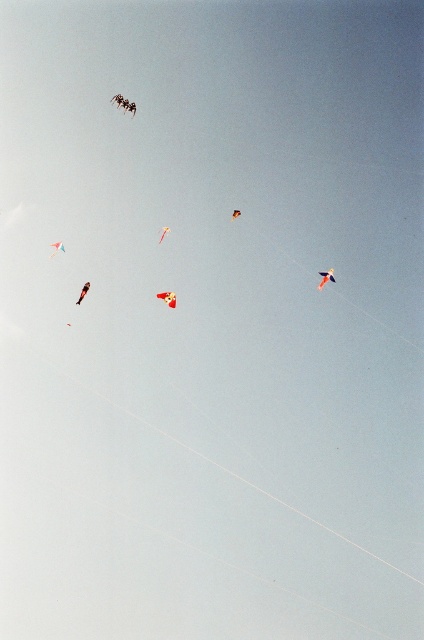
Question: Does shiny metallic kite at upper left lie in front of orange matte kite at upper center?

Choices:
 (A) no
 (B) yes

Answer: (B)

Question: Can you confirm if shiny metallic kite at upper left is thinner than translucent red kite at center?

Choices:
 (A) yes
 (B) no

Answer: (B)

Question: Among these objects, which one is farthest from the camera?

Choices:
 (A) translucent red kite at center
 (B) shiny metallic kite at center
 (C) orange matte kite at upper center
 (D) matte red kite at upper left

Answer: (B)

Question: Which point appears closest to the camera in this image?

Choices:
 (A) (169, 291)
 (B) (88, 289)
 (C) (60, 243)
 (D) (234, 211)

Answer: (A)

Question: Can you confirm if translucent red kite at center is smaller than orange matte kite at upper center?

Choices:
 (A) no
 (B) yes

Answer: (A)

Question: Which of these objects is positioned closest to the red glossy kite at upper center?

Choices:
 (A) orange matte kite at upper center
 (B) shiny metallic kite at center
 (C) matte red kite at upper left

Answer: (A)